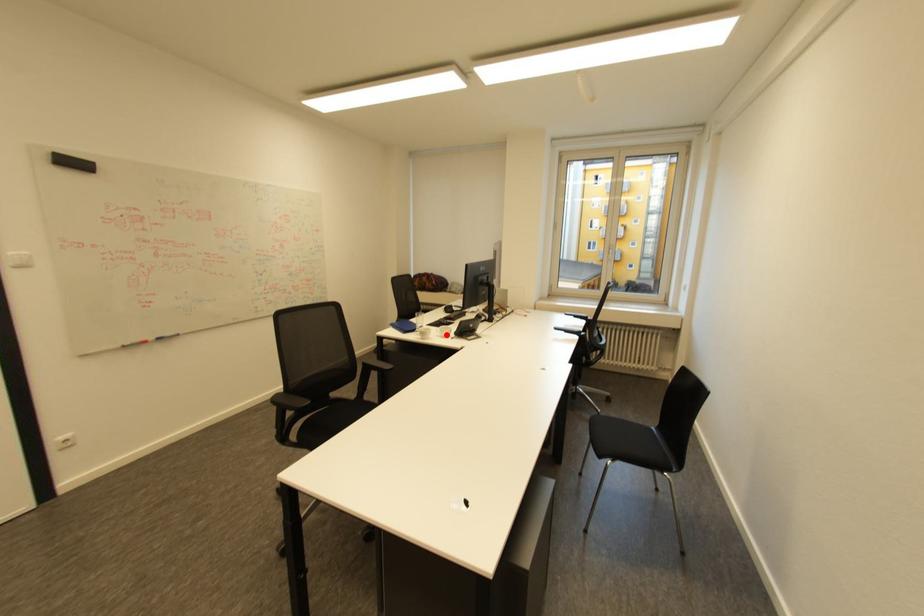
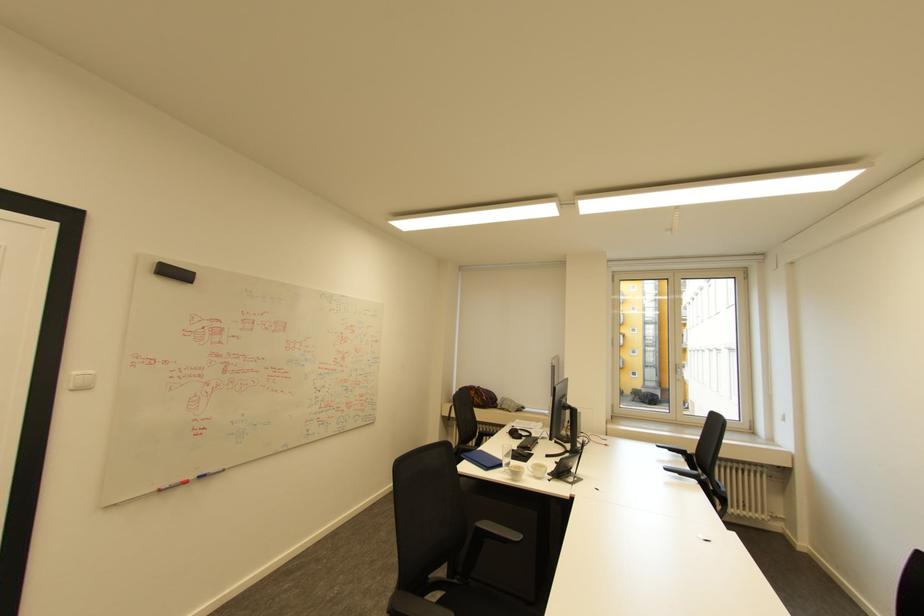
Where in the second image is the point corresponding to the highlighted location from the first image?

(539, 474)